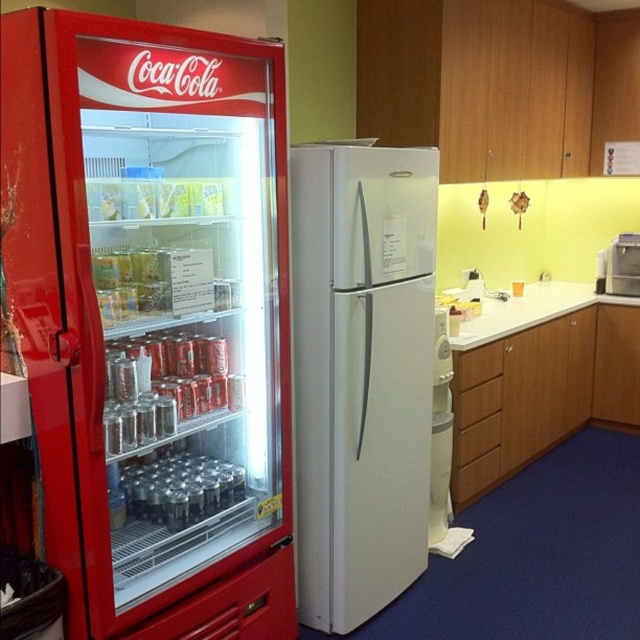
You are a delivery person who needs to place a large box on the highest available surface in the kitchenette. Which object between the metallic red vending machine at left and the white laminate countertop at center should you choose?

The white laminate countertop at center is higher than the metallic red vending machine at left, so you should place the large box on the white laminate countertop at center.

You are setting up a new coffee machine and need to place it on the countertop next to the white matte refrigerator at center. The metallic silver coffee machine at upper right requires at least 10 cm of clearance above it to avoid blocking the coffee machine. Can you place it there based on their heights?

The white matte refrigerator at center is taller than the metallic silver coffee machine at upper right. Since the refrigerator is taller, there should be enough vertical space above the coffee machine to meet the clearance requirement.

What are the coordinates of the white matte refrigerator at center?

The white matte refrigerator at center is located at coordinates point (362, 372).